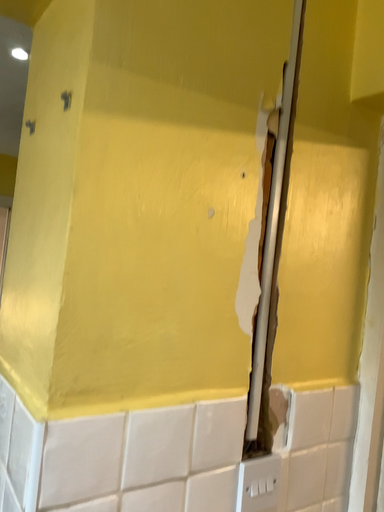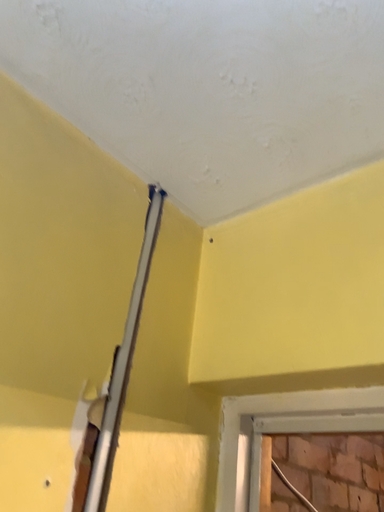
Question: How did the camera likely rotate when shooting the video?

Choices:
 (A) rotated right
 (B) rotated left

Answer: (A)